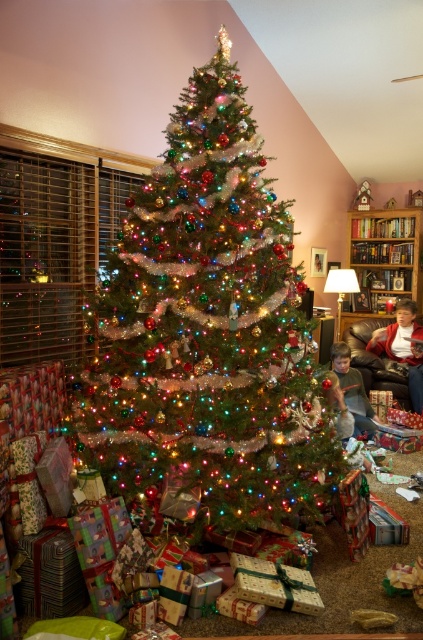
Question: Which of the following is the farthest from the observer?

Choices:
 (A) (208, 236)
 (B) (397, 308)

Answer: (B)

Question: In this image, where is wooden bookshelf at right located relative to matte red sweater at lower right?

Choices:
 (A) left
 (B) right

Answer: (B)

Question: Considering the real-world distances, which object is closest to the matte red sweater at lower right?

Choices:
 (A) green fabric shirt at lower center
 (B) wooden bookshelf at right
 (C) shiny green christmas tree at center

Answer: (A)

Question: Is wooden bookshelf at right above matte red sweater at lower right?

Choices:
 (A) no
 (B) yes

Answer: (B)

Question: Estimate the real-world distances between objects in this image. Which object is closer to the shiny green christmas tree at center?

Choices:
 (A) wooden bookshelf at right
 (B) matte red sweater at lower right
 (C) green fabric shirt at lower center

Answer: (C)

Question: Can you confirm if wooden bookshelf at right is positioned above green fabric shirt at lower center?

Choices:
 (A) no
 (B) yes

Answer: (B)